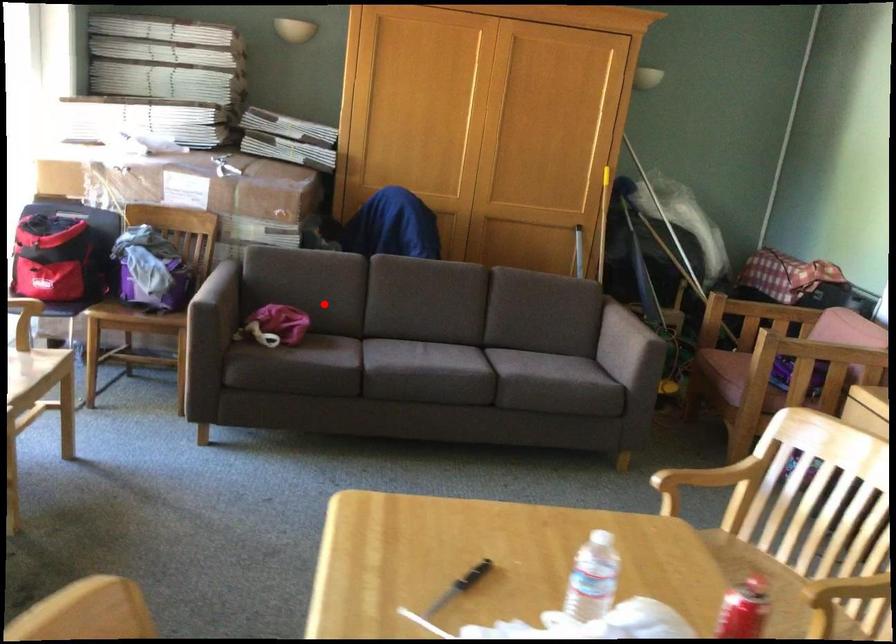
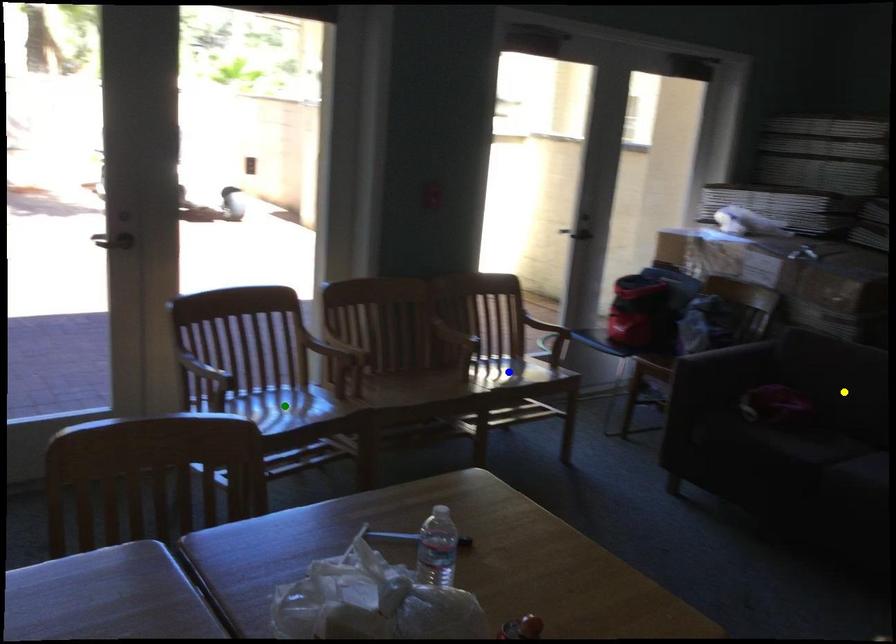
Question: I am providing you with two images of the same scene from different viewpoints. A red point is marked on the first image. You are given multiple points on the second image. Which mark in image 2 goes with the point in image 1?

Choices:
 (A) blue point
 (B) green point
 (C) yellow point

Answer: (C)